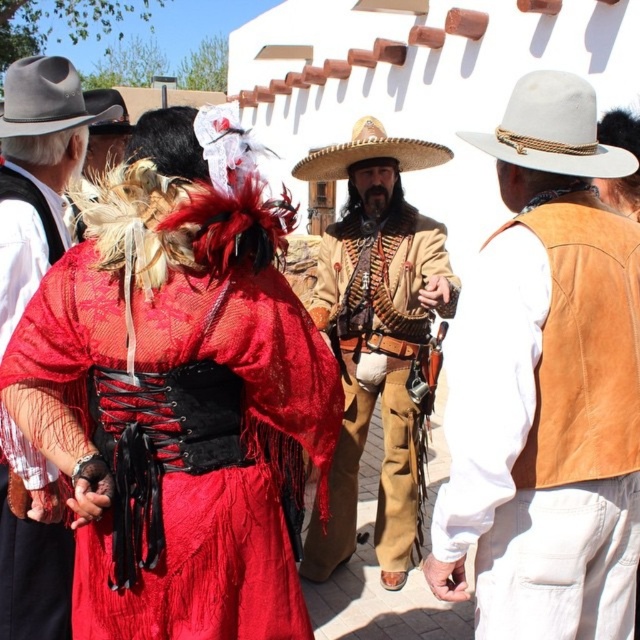
You are a photographer trying to capture a clear shot of the suede tan vest at right and the black felt cowboy hat at upper left. Which object is closer to the camera based on their positions in the scene?

The suede tan vest at right is closer to the camera because it is in front of the black felt cowboy hat at upper left.

You are an artist sketching the scene and want to ensure proper perspective. Which object, the suede tan vest at right or the matte black hat at left, appears nearer to you?

The suede tan vest at right is closer to the viewer than the matte black hat at left, so it appears nearer.

You are standing at the center of the image and want to move towards the point marked at coordinates [545,387]. Which direction should you move to reach it?

The point marked at coordinates [545,387] is on the suede tan vest at right, so you should move to the right to reach it.